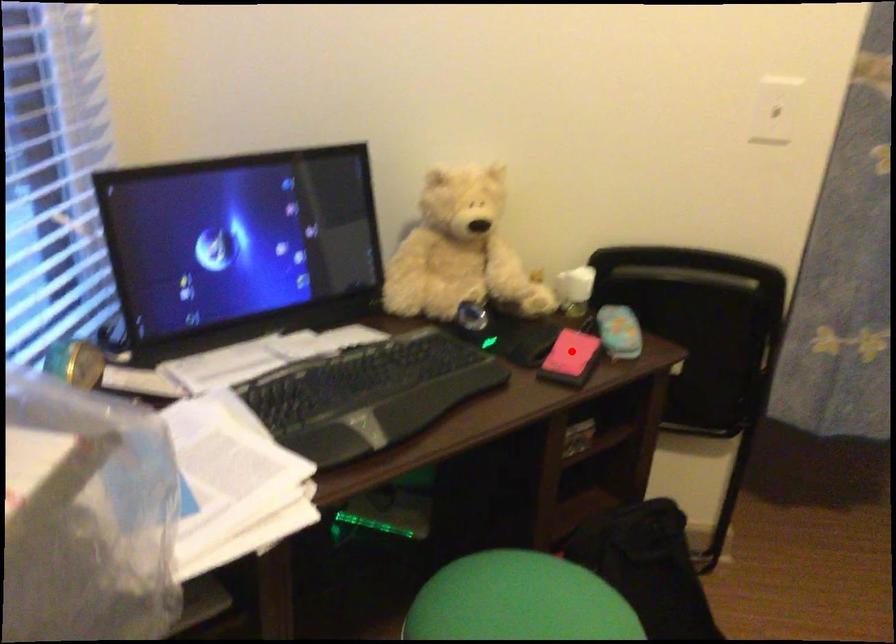
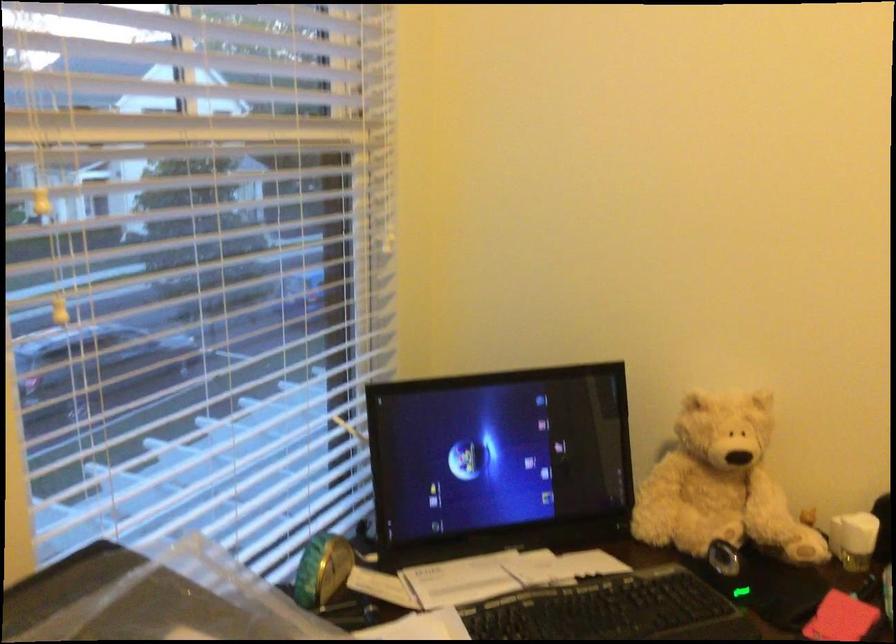
Locate, in the second image, the point that corresponds to the highlighted location in the first image.

(840, 618)